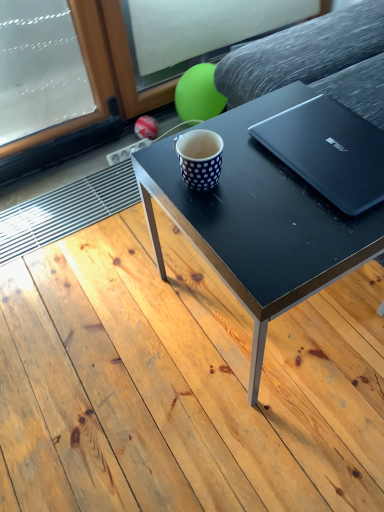
Question: Does black matte coffee table at center have a greater width compared to black matte table at center?

Choices:
 (A) yes
 (B) no

Answer: (B)

Question: Is black matte coffee table at center at the left side of black matte table at center?

Choices:
 (A) no
 (B) yes

Answer: (A)

Question: Considering the relative sizes of black matte coffee table at center and black matte table at center in the image provided, is black matte coffee table at center thinner than black matte table at center?

Choices:
 (A) yes
 (B) no

Answer: (A)

Question: Is black matte coffee table at center not near black matte table at center?

Choices:
 (A) yes
 (B) no

Answer: (B)

Question: Can black matte table at center be found inside black matte coffee table at center?

Choices:
 (A) yes
 (B) no

Answer: (B)

Question: Considering the relative sizes of black matte coffee table at center and black matte table at center in the image provided, is black matte coffee table at center taller than black matte table at center?

Choices:
 (A) no
 (B) yes

Answer: (B)

Question: Is there a large distance between black matte coffee table at center and white dotted mug at center?

Choices:
 (A) no
 (B) yes

Answer: (A)

Question: Does black matte coffee table at center contain white dotted mug at center?

Choices:
 (A) yes
 (B) no

Answer: (B)

Question: Can you confirm if black matte coffee table at center is taller than white dotted mug at center?

Choices:
 (A) no
 (B) yes

Answer: (B)

Question: Is black matte coffee table at center not inside white dotted mug at center?

Choices:
 (A) yes
 (B) no

Answer: (A)

Question: Is black matte coffee table at center placed right next to white dotted mug at center?

Choices:
 (A) yes
 (B) no

Answer: (B)

Question: Considering the relative sizes of black matte coffee table at center and white dotted mug at center in the image provided, is black matte coffee table at center shorter than white dotted mug at center?

Choices:
 (A) no
 (B) yes

Answer: (A)

Question: From the image's perspective, is white dotted mug at center located beneath black matte table at center?

Choices:
 (A) no
 (B) yes

Answer: (A)